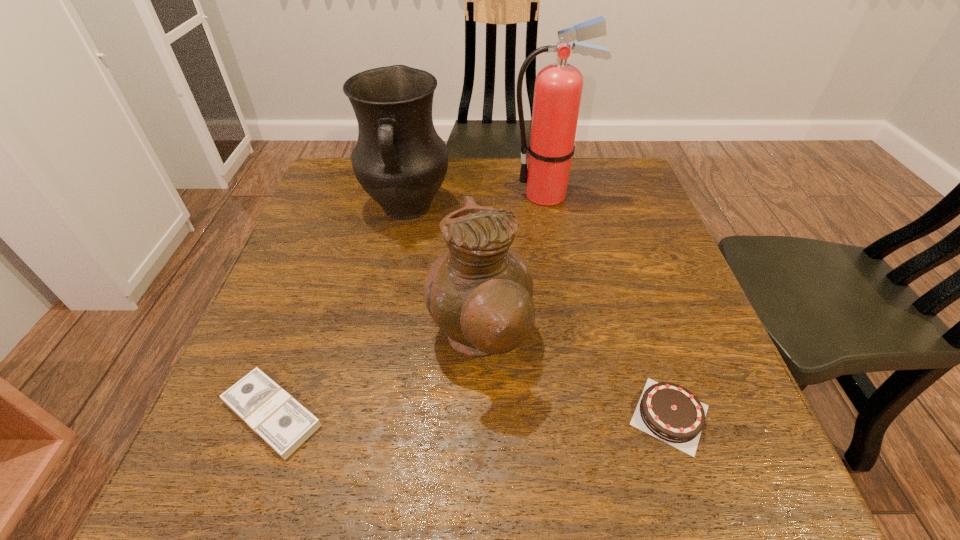
You are a GUI agent. You are given a task and a screenshot of the screen. Output one action in this format:
    pyautogui.click(x=<x>, y=<y>)
    Task: Click on the object present at the near left corner
    
    Given the screenshot: What is the action you would take?
    pyautogui.click(x=283, y=423)

Image resolution: width=960 pixels, height=540 pixels. Find the location of `object present at the near right corner`. object present at the near right corner is located at coordinates (667, 411).

Locate an element on the screen. The image size is (960, 540). vacant position at the far edge of the desktop is located at coordinates (512, 195).

Where is `vacant space at the near edge of the desktop`? vacant space at the near edge of the desktop is located at coordinates (296, 488).

Find the location of a particular element. Image resolution: width=960 pixels, height=540 pixels. vacant space at the left edge of the desktop is located at coordinates (346, 228).

Where is `vacant position at the right edge of the desktop`? The image size is (960, 540). vacant position at the right edge of the desktop is located at coordinates (653, 220).

The image size is (960, 540). In the image, there is a desktop. What are the coordinates of `vacant area at the near left corner` in the screenshot? It's located at (283, 473).

This screenshot has height=540, width=960. Find the location of `vacant space at the far right corner`. vacant space at the far right corner is located at coordinates (620, 174).

In the image, there is a desktop. Where is `blank space at the near right corner`? This screenshot has width=960, height=540. blank space at the near right corner is located at coordinates (725, 450).

Find the location of a particular element. The height and width of the screenshot is (540, 960). blank region between the farther pitcher and the fourth tallest object is located at coordinates (539, 311).